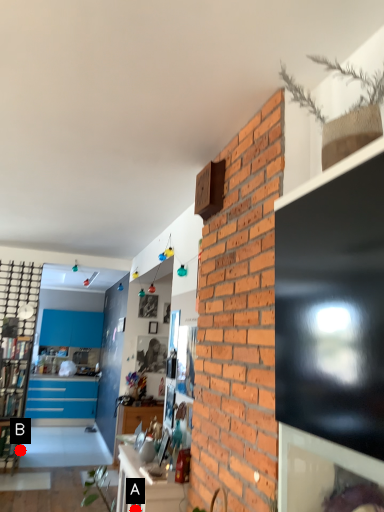
Question: Two points are circled on the image, labeled by A and B beside each circle. Which point appears farthest from the camera in this image?

Choices:
 (A) A is further
 (B) B is further

Answer: (B)